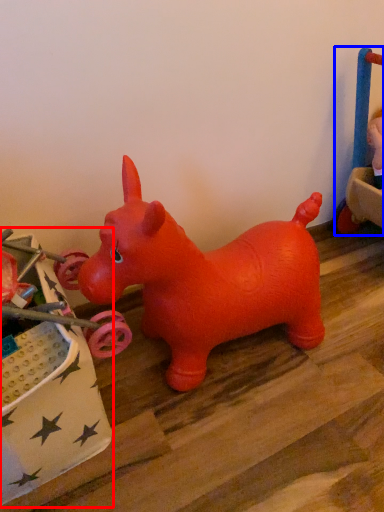
Question: Which object appears closest to the camera in this image, toy (highlighted by a red box) or toy (highlighted by a blue box)?

Choices:
 (A) toy
 (B) toy

Answer: (A)